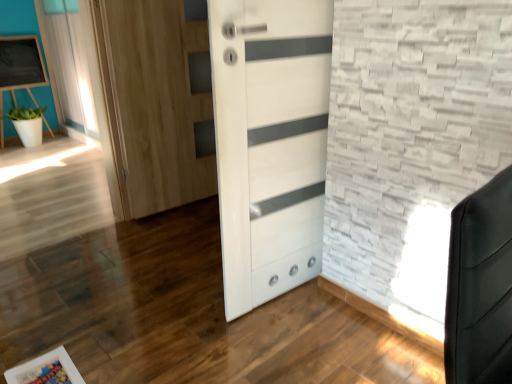
What are the coordinates of `vacant area that lies to the right of wooden picture frame at lower left` in the screenshot? It's located at (116, 362).